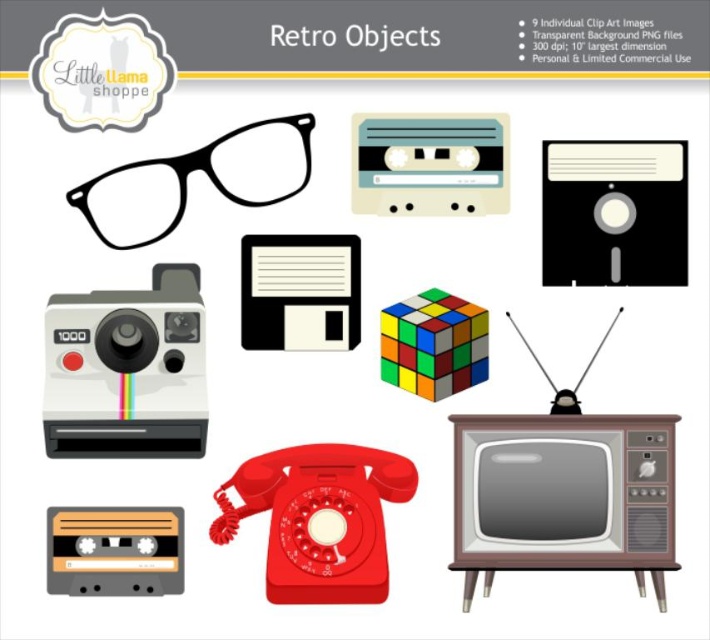
Question: Does black plastic floppy disk at upper right appear over beige matte cassette at center?

Choices:
 (A) no
 (B) yes

Answer: (A)

Question: Which of these objects is positioned farthest from the beige matte cassette at center?

Choices:
 (A) black matte floppy disk at upper center
 (B) black matte glasses at upper left
 (C) black plastic floppy disk at upper right
 (D) orange matte cassette at center

Answer: (D)

Question: Is black plastic floppy disk at upper right positioned in front of black matte glasses at upper left?

Choices:
 (A) yes
 (B) no

Answer: (B)

Question: Where is black matte glasses at upper left located in relation to black matte floppy disk at upper center in the image?

Choices:
 (A) right
 (B) left

Answer: (B)

Question: Considering the real-world distances, which object is closest to the beige matte cassette at center?

Choices:
 (A) black matte glasses at upper left
 (B) orange matte cassette at center
 (C) black plastic floppy disk at upper right
 (D) black matte floppy disk at upper center

Answer: (D)

Question: Which of the following is the farthest from the observer?

Choices:
 (A) white glossy polaroid camera at upper left
 (B) black plastic floppy disk at upper right

Answer: (B)